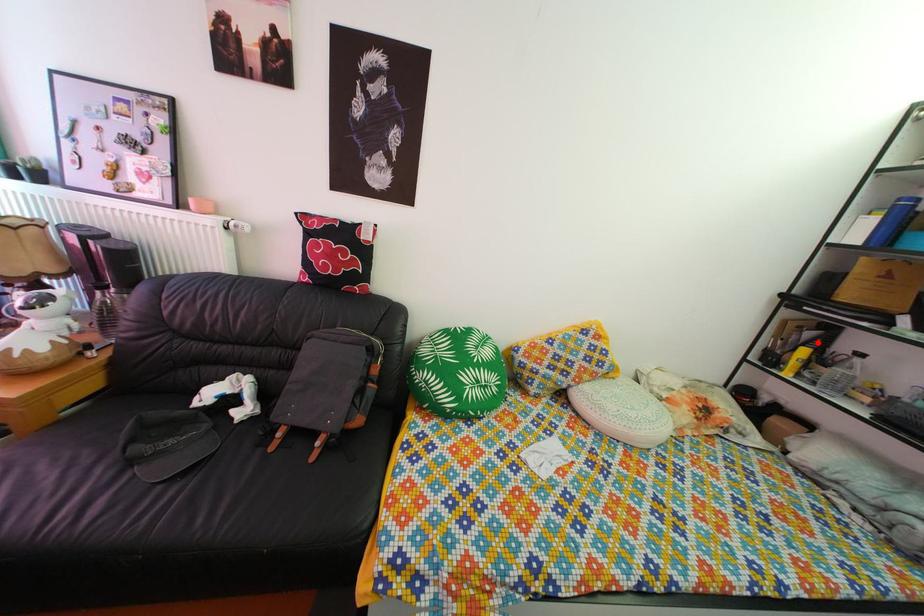
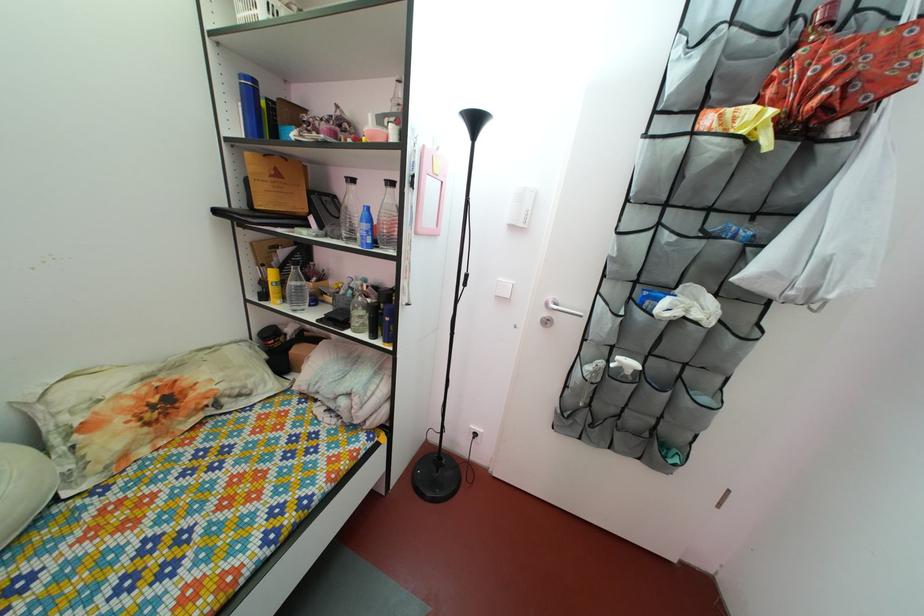
Locate, in the second image, the point that corresponds to the highlighted location in the first image.

(292, 262)